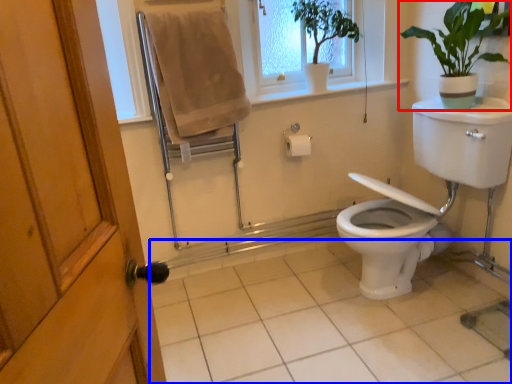
Question: Which point is closer to the camera, houseplant (highlighted by a red box) or tile (highlighted by a blue box)?

Choices:
 (A) houseplant
 (B) tile

Answer: (B)